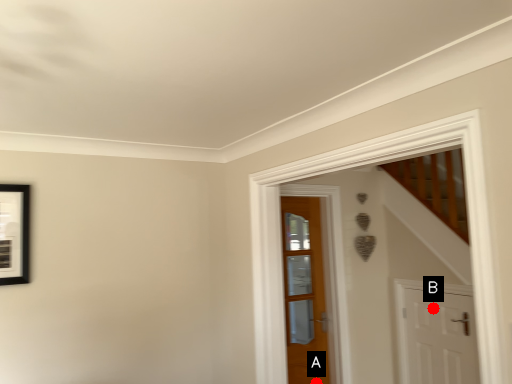
Question: Two points are circled on the image, labeled by A and B beside each circle. Which point is closer to the camera?

Choices:
 (A) A is closer
 (B) B is closer

Answer: (B)